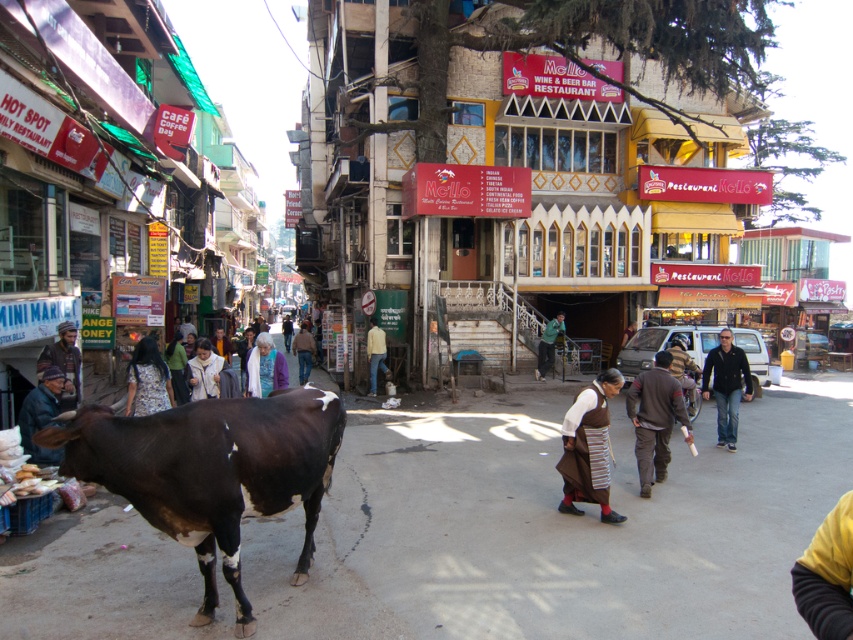
Question: Is yellow fabric at lower right further to camera compared to yellow cotton shirt at center?

Choices:
 (A) yes
 (B) no

Answer: (B)

Question: Which object is the farthest from the dark brown leather jacket at center?

Choices:
 (A) purple woolen sweater at center
 (B) white woolen sweater at center

Answer: (B)

Question: Which point is farther from the camera taking this photo?

Choices:
 (A) (55, 458)
 (B) (730, 356)
 (C) (572, 435)
 (D) (144, 358)

Answer: (B)

Question: Does dark brown leather jacket at center right have a lesser width compared to brown leather jacket at center?

Choices:
 (A) yes
 (B) no

Answer: (A)

Question: In this image, where is dark brown leather jacket at center right located relative to brown leather jacket at center?

Choices:
 (A) right
 (B) left

Answer: (A)

Question: Which object is positioned farthest from the yellow cotton shirt at center?

Choices:
 (A) purple woolen sweater at center
 (B) black glossy bull at lower left

Answer: (B)